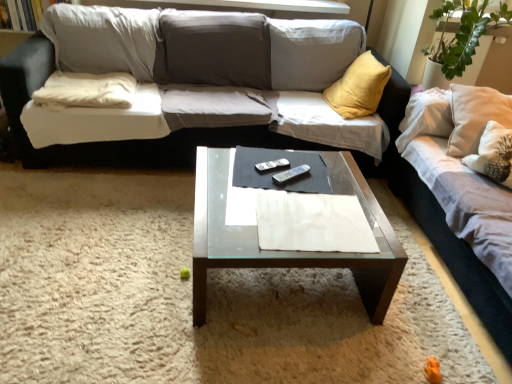
Identify the location of vacant space situated on the left part of silver metallic remote at center, marked as the 1th remote in a top-to-bottom arrangement. (237, 163).